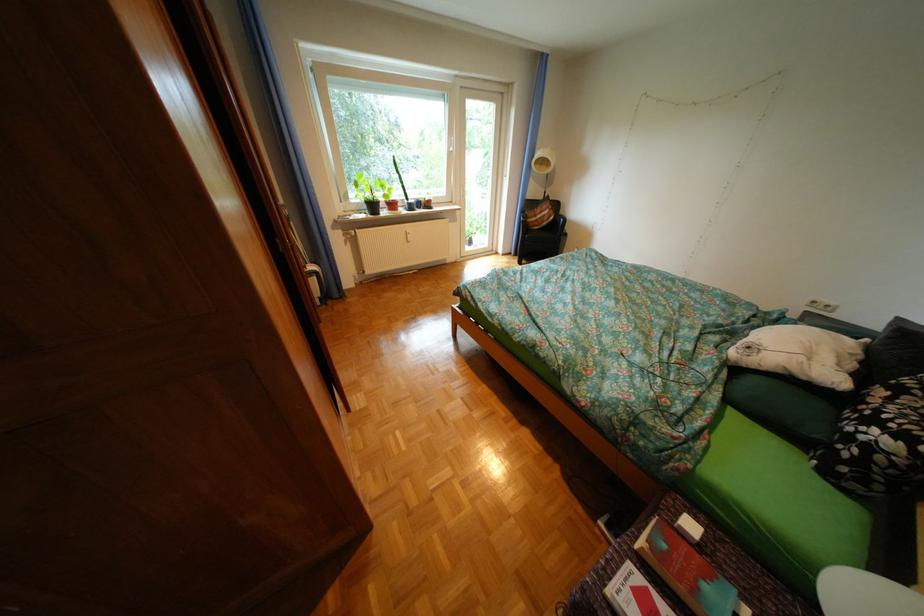
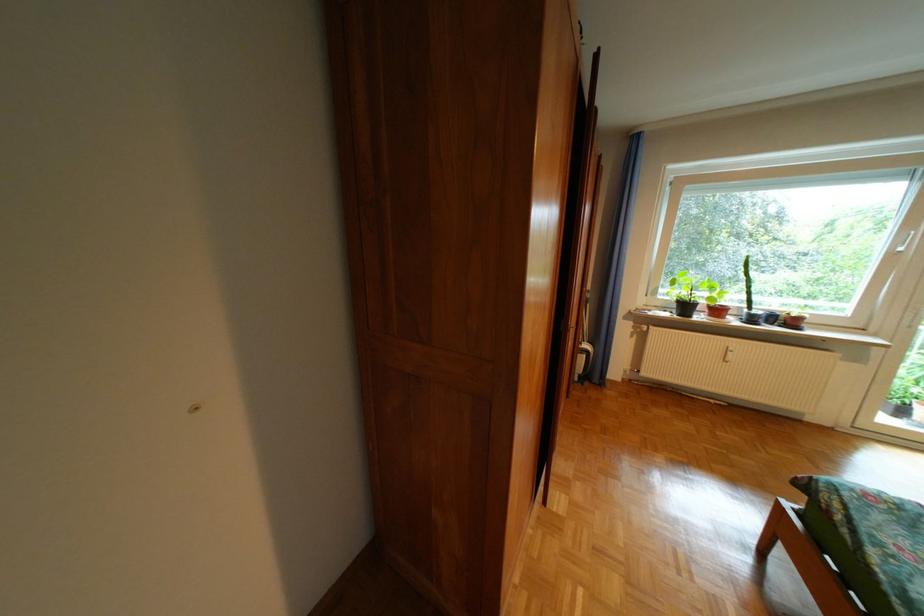
Question: The camera is either moving clockwise (left) or counter-clockwise (right) around the object. The first image is from the beginning of the video and the second image is from the end. Is the camera moving left or right when shooting the video?

Choices:
 (A) Left
 (B) Right

Answer: (B)